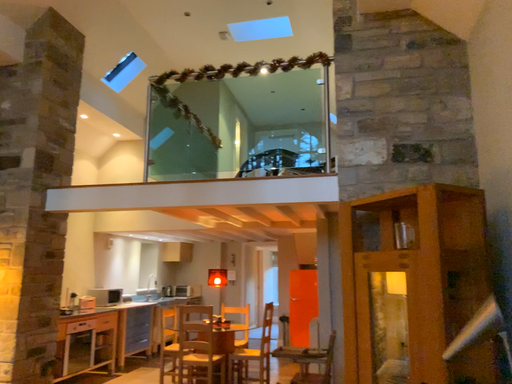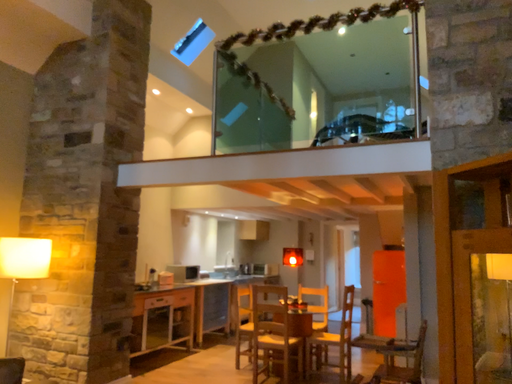
Question: How did the camera likely rotate when shooting the video?

Choices:
 (A) rotated left
 (B) rotated right

Answer: (A)